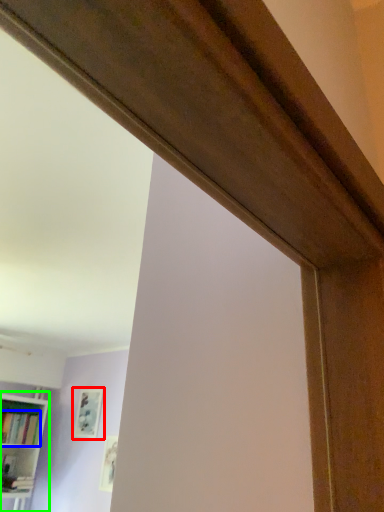
Question: Which object is the farthest from picture frame (highlighted by a red box)? Choose among these: book (highlighted by a blue box) or bookcase (highlighted by a green box).

Choices:
 (A) book
 (B) bookcase

Answer: (B)